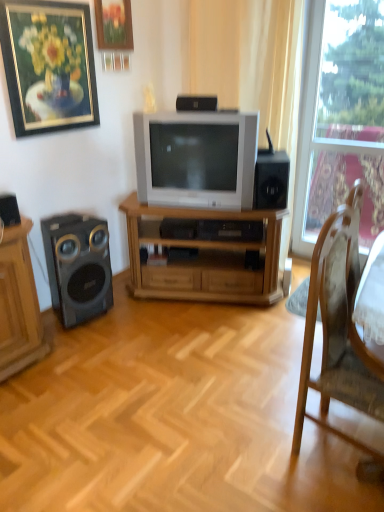
The height and width of the screenshot is (512, 384). What do you see at coordinates (204, 258) in the screenshot?
I see `wooden tv stand at center` at bounding box center [204, 258].

Describe the element at coordinates (114, 24) in the screenshot. This screenshot has width=384, height=512. I see `wooden picture frame at upper center, the second picture frame in the left-to-right sequence` at that location.

What do you see at coordinates (48, 65) in the screenshot?
I see `gold-framed painting at upper left, the 1th picture frame from the left` at bounding box center [48, 65].

Locate an element on the screen. The height and width of the screenshot is (512, 384). transparent glass window at right is located at coordinates (341, 118).

I want to click on matte black speaker at left, so click(x=78, y=266).

I want to click on wooden tv stand at center, so click(204, 258).

From the image's perspective, is transparent glass window at right located above matte black speaker at left?

Correct, transparent glass window at right appears higher than matte black speaker at left in the image.

Considering the positions of points (360, 108) and (102, 296), is point (360, 108) farther from camera compared to point (102, 296)?

That is True.

What's the angular difference between transparent glass window at right and matte black speaker at left's facing directions?

83.9 degrees.

Is transparent glass window at right inside or outside of matte black speaker at left?

transparent glass window at right is outside matte black speaker at left.

Which object is closer to the camera taking this photo, black matte speaker at left, acting as the third speaker starting from the back, or wooden picture frame at upper center, the second picture frame in the left-to-right sequence?

black matte speaker at left, acting as the third speaker starting from the back, is more forward.

Are black matte speaker at left, acting as the first speaker starting from the front, and wooden picture frame at upper center, marked as the first picture frame in a right-to-left arrangement, far apart?

Yes, black matte speaker at left, acting as the first speaker starting from the front, and wooden picture frame at upper center, marked as the first picture frame in a right-to-left arrangement, are quite far apart.

In the scene shown: Is black matte speaker at left, acting as the third speaker starting from the back, at the left side of wooden picture frame at upper center, the second picture frame in the left-to-right sequence?

Yes.

Between transparent glass window at right and black matte speaker at upper center, the second speaker positioned from the right, which one has larger size?

transparent glass window at right is bigger.

Is point (347, 25) positioned after point (207, 109)?

Yes, it is.

Would you say transparent glass window at right is a long distance from black matte speaker at upper center, acting as the second speaker starting from the front?

transparent glass window at right is positioned a significant distance from black matte speaker at upper center, acting as the second speaker starting from the front.

Considering their positions, is transparent glass window at right located in front of or behind black matte speaker at upper center, acting as the 1th speaker starting from the top?

Visually, transparent glass window at right is located behind black matte speaker at upper center, acting as the 1th speaker starting from the top.

Would you say black matte speaker at left, the 3th speaker when ordered from right to left, is inside or outside gold-framed painting at upper left, marked as the second picture frame in a right-to-left arrangement?

black matte speaker at left, the 3th speaker when ordered from right to left, is outside gold-framed painting at upper left, marked as the second picture frame in a right-to-left arrangement.

Consider the image. Is black matte speaker at left, which is counted as the third speaker, starting from the top, to the left of gold-framed painting at upper left, marked as the second picture frame in a right-to-left arrangement, from the viewer's perspective?

Indeed, black matte speaker at left, which is counted as the third speaker, starting from the top, is positioned on the left side of gold-framed painting at upper left, marked as the second picture frame in a right-to-left arrangement.

From the image's perspective, is black matte speaker at left, positioned as the first speaker in left-to-right order, positioned above or below gold-framed painting at upper left, marked as the second picture frame in a right-to-left arrangement?

From the image's perspective, black matte speaker at left, positioned as the first speaker in left-to-right order, appears below gold-framed painting at upper left, marked as the second picture frame in a right-to-left arrangement.

Is wooden picture frame at upper center, marked as the first picture frame in a right-to-left arrangement, not close to wooden tv stand at center?

Yes, wooden picture frame at upper center, marked as the first picture frame in a right-to-left arrangement, is far from wooden tv stand at center.

From the picture: From the image's perspective, is wooden picture frame at upper center, the second picture frame in the left-to-right sequence, located beneath wooden tv stand at center?

Actually, wooden picture frame at upper center, the second picture frame in the left-to-right sequence, appears above wooden tv stand at center in the image.

You are a GUI agent. You are given a task and a screenshot of the screen. Output one action in this format:
    pyautogui.click(x=<x>, y=<y>)
    Task: Click on the desk on the right of wooden picture frame at upper center, the second picture frame in the left-to-right sequence
    
    Given the screenshot: What is the action you would take?
    pyautogui.click(x=204, y=258)

Could you measure the distance between wooden picture frame at upper center, the second picture frame in the left-to-right sequence, and wooden tv stand at center?

wooden picture frame at upper center, the second picture frame in the left-to-right sequence, and wooden tv stand at center are 1.40 meters apart from each other.

Identify the location of speaker below the black matte speaker at right, which is counted as the first speaker, starting from the right (from the image's perspective). pos(9,210).

Is black matte speaker at left, acting as the first speaker starting from the front, positioned with its back to black matte speaker at right, the first speaker positioned from the back?

black matte speaker at left, acting as the first speaker starting from the front, does not have its back to black matte speaker at right, the first speaker positioned from the back.

Between black matte speaker at left, the 3th speaker when ordered from right to left, and black matte speaker at right, the first speaker positioned from the back, which one has smaller size?

black matte speaker at left, the 3th speaker when ordered from right to left, is smaller.

Between wooden picture frame at upper center, marked as the first picture frame in a right-to-left arrangement, and matte silver television at center, which one appears on the right side from the viewer's perspective?

Positioned to the right is matte silver television at center.

Is wooden picture frame at upper center, the second picture frame in the left-to-right sequence, bigger or smaller than matte silver television at center?

Considering their sizes, wooden picture frame at upper center, the second picture frame in the left-to-right sequence, takes up less space than matte silver television at center.

Consider the image. Is matte silver television at center at the back of wooden picture frame at upper center, marked as the first picture frame in a right-to-left arrangement?

wooden picture frame at upper center, marked as the first picture frame in a right-to-left arrangement, is not turned away from matte silver television at center.

From the image's perspective, which one is positioned higher, wooden picture frame at upper center, marked as the first picture frame in a right-to-left arrangement, or matte silver television at center?

wooden picture frame at upper center, marked as the first picture frame in a right-to-left arrangement.

Image resolution: width=384 pixels, height=512 pixels. In order to click on window above the matte black speaker at left (from the image's perspective) in this screenshot , I will do `click(341, 118)`.

From the image's perspective, count 3rd speakers downward from the wooden picture frame at upper center, marked as the first picture frame in a right-to-left arrangement, and point to it. Please provide its 2D coordinates.

[(9, 210)]

When comparing their distances from wooden picture frame at upper center, marked as the first picture frame in a right-to-left arrangement, does wooden tv stand at center or black matte speaker at right, the 2th speaker in the top-to-bottom sequence, seem closer?

Based on the image, black matte speaker at right, the 2th speaker in the top-to-bottom sequence, appears to be nearer to wooden picture frame at upper center, marked as the first picture frame in a right-to-left arrangement.

Estimate the real-world distances between objects in this image. Which object is closer to gold-framed painting at upper left, marked as the second picture frame in a right-to-left arrangement, matte silver television at center or wooden picture frame at upper center, marked as the first picture frame in a right-to-left arrangement?

The object closer to gold-framed painting at upper left, marked as the second picture frame in a right-to-left arrangement, is wooden picture frame at upper center, marked as the first picture frame in a right-to-left arrangement.

Estimate the real-world distances between objects in this image. Which object is closer to gold-framed painting at upper left, the 1th picture frame from the left, wooden tv stand at center or matte silver television at center?

matte silver television at center lies closer to gold-framed painting at upper left, the 1th picture frame from the left, than the other object.

Which object lies nearer to the anchor point wooden picture frame at upper center, the second picture frame in the left-to-right sequence, black matte speaker at upper center, acting as the second speaker starting from the front, or transparent glass window at right?

black matte speaker at upper center, acting as the second speaker starting from the front, is closer to wooden picture frame at upper center, the second picture frame in the left-to-right sequence.

From the image, which object appears to be farther from wooden tv stand at center, black matte speaker at upper center, the third speaker from the bottom, or wooden chair at right?

wooden chair at right lies further to wooden tv stand at center than the other object.

When comparing their distances from wooden tv stand at center, does matte silver television at center or wooden picture frame at upper center, marked as the first picture frame in a right-to-left arrangement, seem further?

The object further to wooden tv stand at center is wooden picture frame at upper center, marked as the first picture frame in a right-to-left arrangement.

Which object lies further to the anchor point black matte speaker at upper center, the third speaker from the bottom, black matte speaker at right, which appears as the 3th speaker when viewed from the left, or wooden picture frame at upper center, marked as the first picture frame in a right-to-left arrangement?

wooden picture frame at upper center, marked as the first picture frame in a right-to-left arrangement.

From the image, which object appears to be farther from wooden tv stand at center, black matte speaker at right, the 3th speaker when ordered from front to back, or black matte speaker at left, placed as the first speaker when sorted from bottom to top?

black matte speaker at left, placed as the first speaker when sorted from bottom to top, lies further to wooden tv stand at center than the other object.

Locate an element on the screen. The height and width of the screenshot is (512, 384). desk between wooden picture frame at upper center, the second picture frame in the left-to-right sequence, and matte black speaker at left vertically is located at coordinates tap(204, 258).

This screenshot has height=512, width=384. Identify the location of television located between matte black speaker at left and black matte speaker at right, the 3th speaker when ordered from front to back, in the left-right direction. (196, 158).

Find the location of a particular element. This screenshot has width=384, height=512. television between black matte speaker at upper center, the 2th speaker positioned from the back, and black matte speaker at right, which appears as the 3th speaker when viewed from the left is located at coordinates (196, 158).

You are a GUI agent. You are given a task and a screenshot of the screen. Output one action in this format:
    pyautogui.click(x=<x>, y=<y>)
    Task: Click on the television between black matte speaker at upper center, the 2th speaker positioned from the back, and matte black speaker at left, in the vertical direction
    
    Given the screenshot: What is the action you would take?
    pyautogui.click(x=196, y=158)